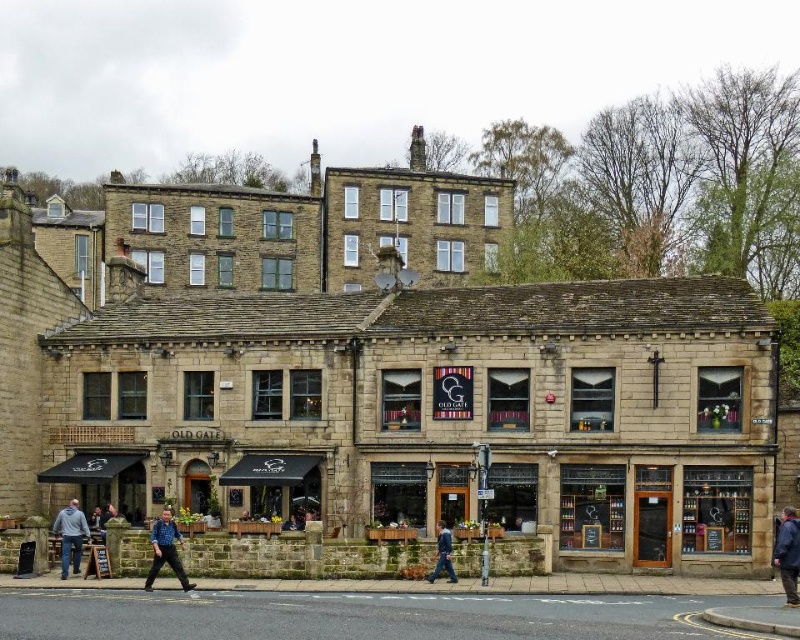
Question: Is blue denim jeans at lower left bigger than blue denim jacket at center?

Choices:
 (A) no
 (B) yes

Answer: (B)

Question: Considering the real-world distances, which object is farthest from the blue denim jeans at lower left?

Choices:
 (A) blue denim jacket at center
 (B) denim jacket at lower left
 (C) blue fabric jacket at lower right
 (D) stone building at center

Answer: (C)

Question: Does stone building at center appear over blue denim jeans at lower left?

Choices:
 (A) no
 (B) yes

Answer: (B)

Question: Which object appears closest to the camera in this image?

Choices:
 (A) blue denim jacket at center
 (B) denim jacket at lower left

Answer: (A)

Question: Considering the relative positions of denim jacket at lower left and blue denim jacket at center in the image provided, where is denim jacket at lower left located with respect to blue denim jacket at center?

Choices:
 (A) below
 (B) above

Answer: (A)

Question: Which object is farther from the camera taking this photo?

Choices:
 (A) blue denim jacket at center
 (B) blue denim jeans at lower left

Answer: (A)